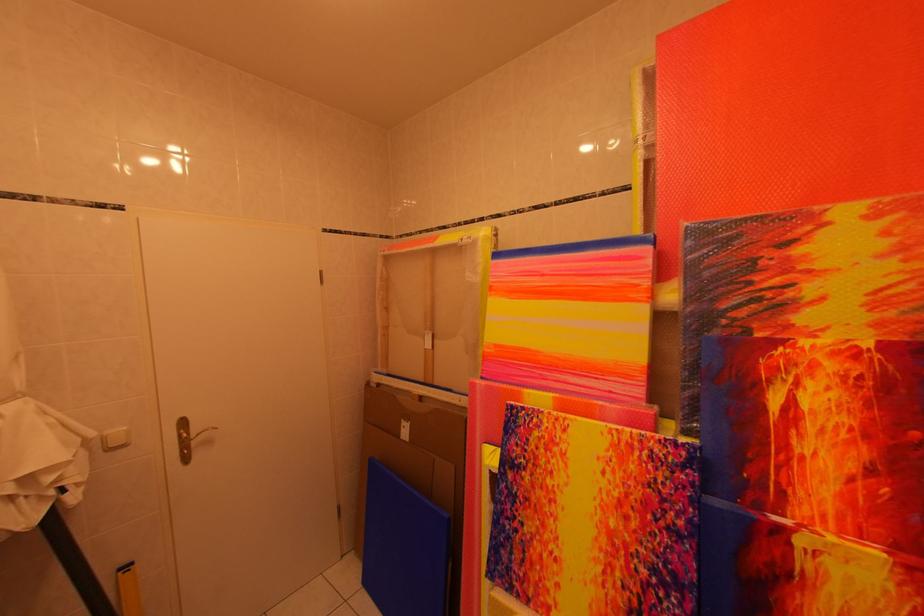
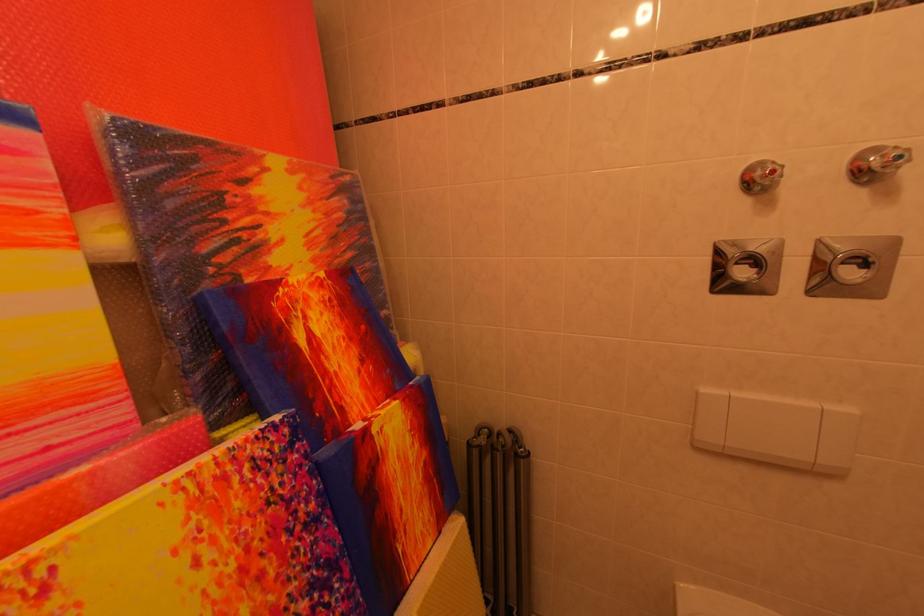
The point at (x=642, y=528) is marked in the first image. Where is the corresponding point in the second image?

(281, 575)